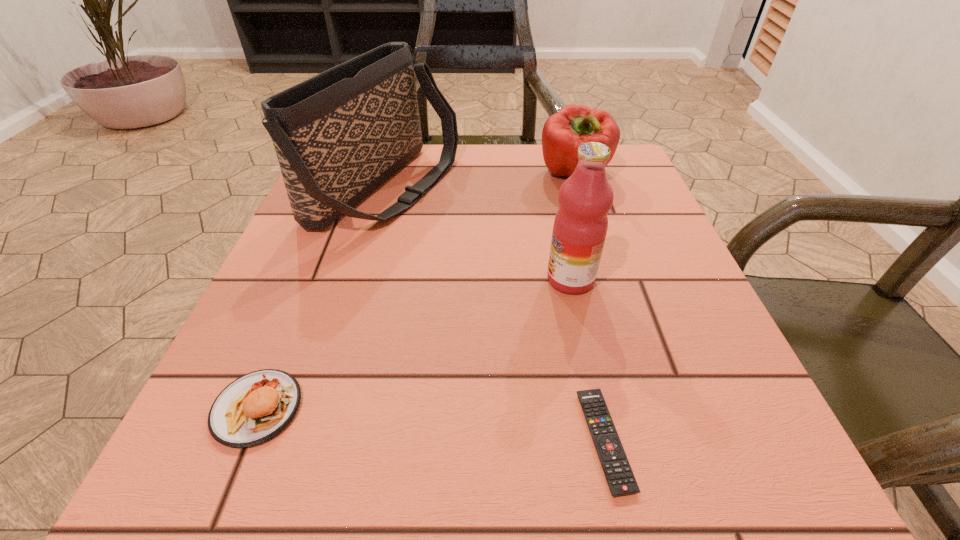
Where is `vacant point that satisfies the following two spatial constraints: 1. on the label of the third farthest object; 2. on the front side of the shortest object`? This screenshot has height=540, width=960. vacant point that satisfies the following two spatial constraints: 1. on the label of the third farthest object; 2. on the front side of the shortest object is located at coordinates (606, 441).